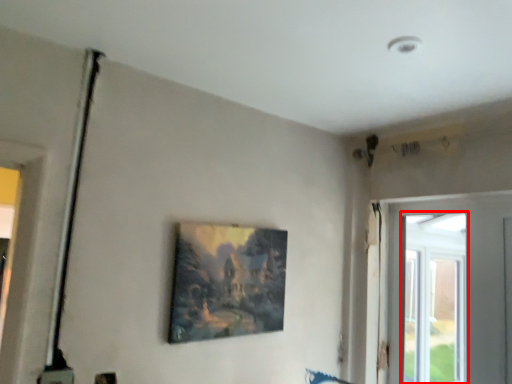
Question: From the image's perspective, where is window (annotated by the red box) located relative to picture frame?

Choices:
 (A) above
 (B) below

Answer: (B)